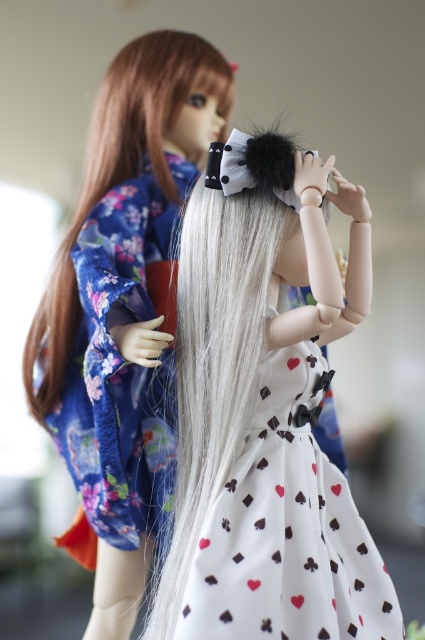
You are a tailor trying to decide which item to place on a display stand that can only hold items shorter than 30 cm. You have the white printed fabric dress at center and the white silky hair at upper left. Based on their heights, which item should you choose?

The white printed fabric dress at center is not as tall as white silky hair at upper left, so the dress is shorter and should be placed on the display stand.